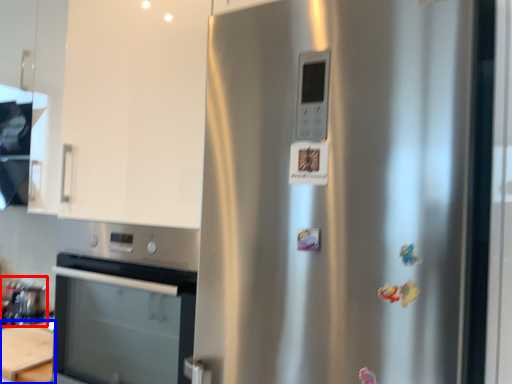
Question: Which object is further to the camera taking this photo, appliance (highlighted by a red box) or table (highlighted by a blue box)?

Choices:
 (A) appliance
 (B) table

Answer: (A)